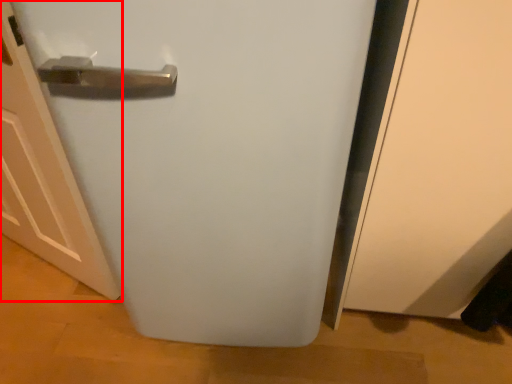
Question: From the image's perspective, where is door (annotated by the red box) located relative to refrigerator?

Choices:
 (A) below
 (B) above

Answer: (A)